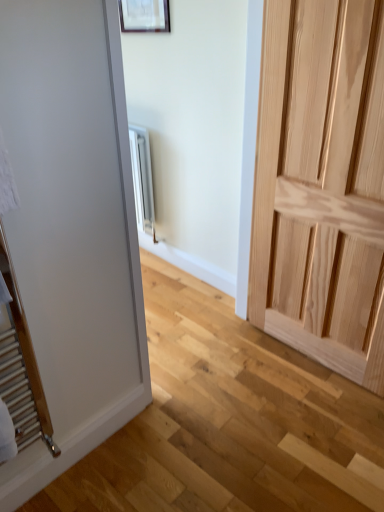
At what (x,y) coordinates should I click in order to perform the action: click on vacant area in front of natural wood door at right. Please return your answer as a coordinate pair (x, y). Image resolution: width=384 pixels, height=512 pixels. Looking at the image, I should click on (307, 423).